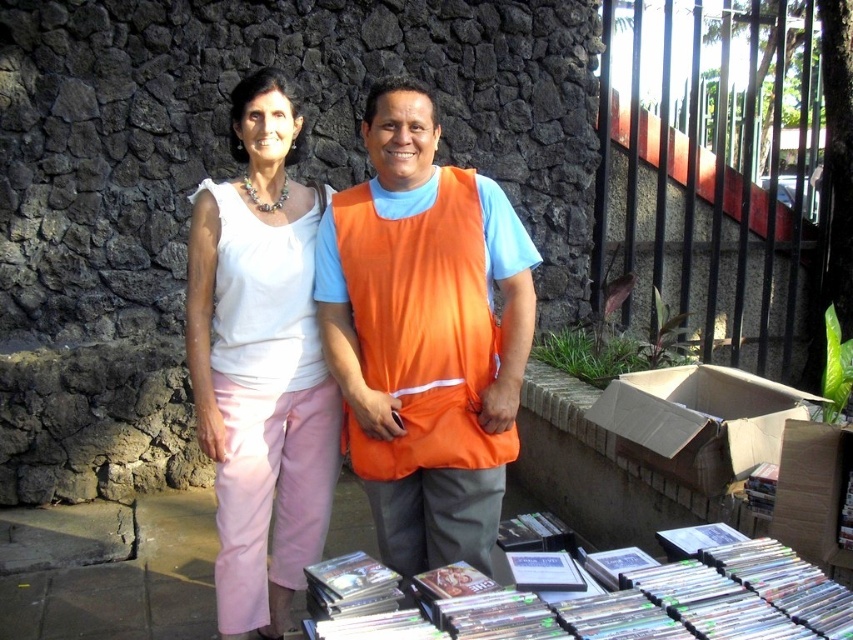
Question: Among these points, which one is farthest from the camera?

Choices:
 (A) (572, 605)
 (B) (321, 250)
 (C) (677, 413)

Answer: (C)

Question: Can you confirm if clear plastic dvds at lower center is bigger than cardboard box at lower right?

Choices:
 (A) yes
 (B) no

Answer: (B)

Question: Does clear plastic dvds at lower center have a smaller size compared to cardboard box at lower right?

Choices:
 (A) yes
 (B) no

Answer: (A)

Question: From the image, what is the correct spatial relationship of white matte tank top at center in relation to cardboard box at lower right?

Choices:
 (A) right
 (B) left

Answer: (B)

Question: Which point appears closest to the camera in this image?

Choices:
 (A) (335, 276)
 (B) (219, 596)
 (C) (757, 378)

Answer: (A)

Question: Which point is closer to the camera taking this photo?

Choices:
 (A) (442, 499)
 (B) (689, 429)
 (C) (248, 125)
 (D) (515, 637)

Answer: (D)